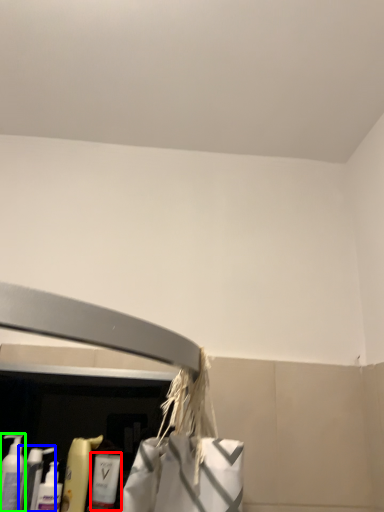
Question: Based on their relative distances, which object is nearer to cleaning product (highlighted by a red box)? Choose from cleaning product (highlighted by a blue box) and cleaning product (highlighted by a green box).

Choices:
 (A) cleaning product
 (B) cleaning product

Answer: (A)